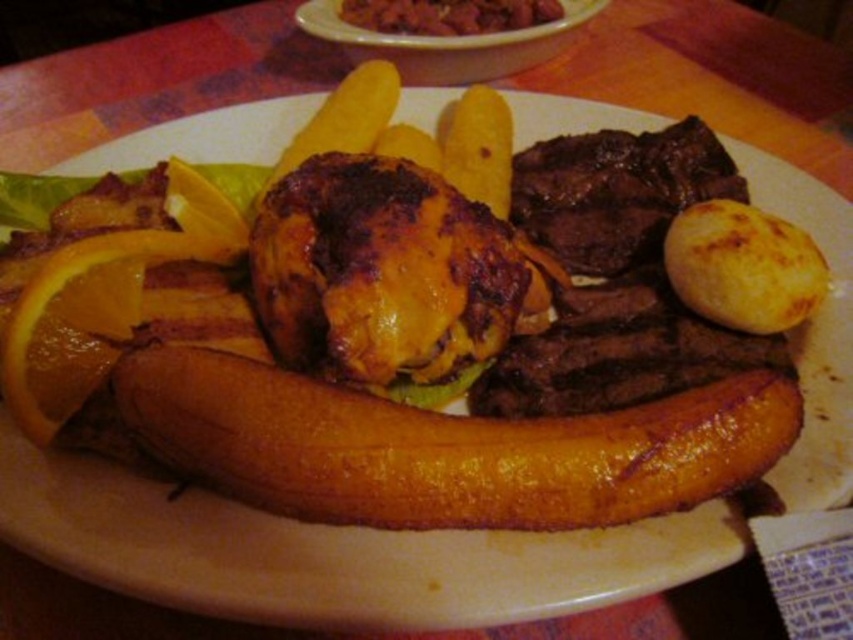
Does brown crispy beef at center have a greater height compared to golden brown baked potato at right?

Correct, brown crispy beef at center is much taller as golden brown baked potato at right.

Which of these two, brown crispy beef at center or golden brown baked potato at right, stands taller?

Standing taller between the two is brown crispy beef at center.

Between point (363, 342) and point (764, 276), which one is positioned behind?

The point (764, 276) is more distant.

Locate an element on the screen. brown crispy beef at center is located at coordinates (381, 272).

Locate an element on the screen. The width and height of the screenshot is (853, 640). brown crispy beef at center is located at coordinates (381, 272).

The height and width of the screenshot is (640, 853). In order to click on brown crispy beef at center in this screenshot , I will do click(x=381, y=272).

Can you confirm if golden brown baked potato at right is thinner than brown crispy meat at upper center?

Indeed, golden brown baked potato at right has a lesser width compared to brown crispy meat at upper center.

Measure the distance between point (820, 278) and camera.

They are 1.16 meters apart.

Is point (791, 248) farther from viewer compared to point (379, 19)?

No, (791, 248) is in front of (379, 19).

Locate an element on the screen. The image size is (853, 640). golden brown baked potato at right is located at coordinates (743, 266).